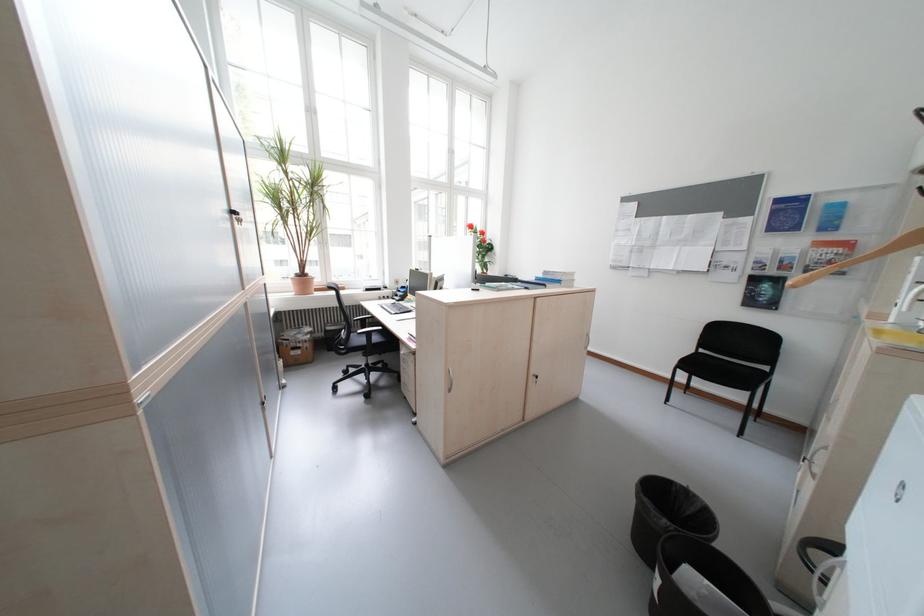
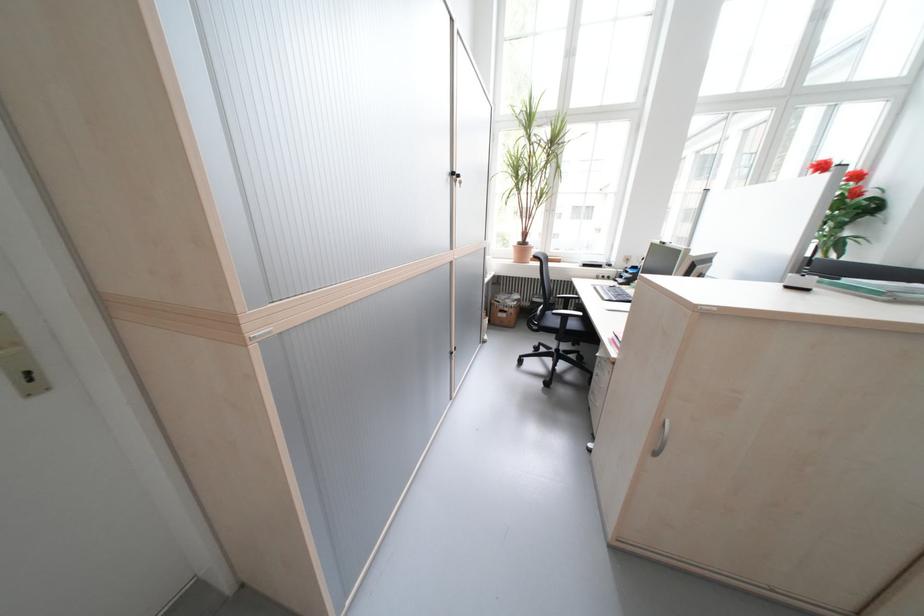
Find the pixel in the second image that matches pixel 380 334 in the first image.

(575, 318)